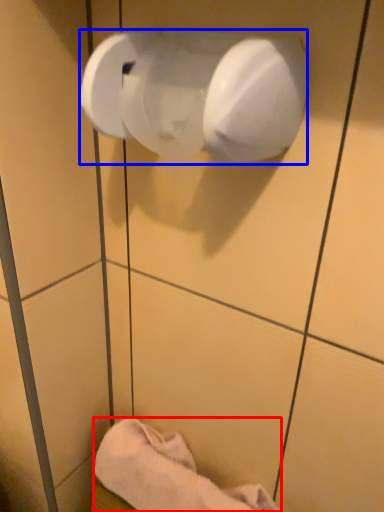
Question: Among these objects, which one is nearest to the camera, towel (highlighted by a red box) or toilet paper (highlighted by a blue box)?

Choices:
 (A) towel
 (B) toilet paper

Answer: (B)